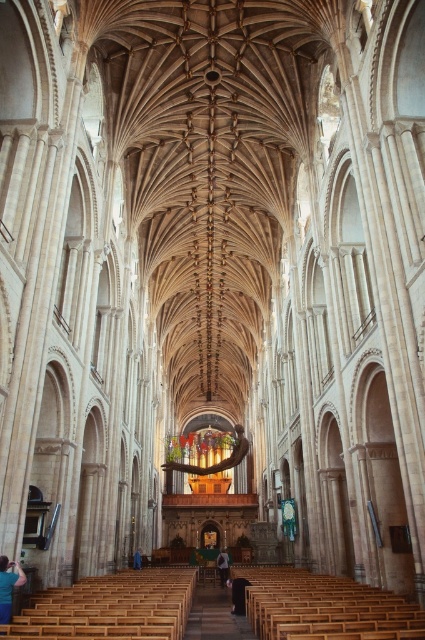
You are standing in the cathedral and notice two blue fabrics. One is the blue fabric person at lower left, and the other is the blue fabric at center. Which of the two blue fabrics is smaller in size?

The blue fabric person at lower left is smaller in size compared to the blue fabric at center.